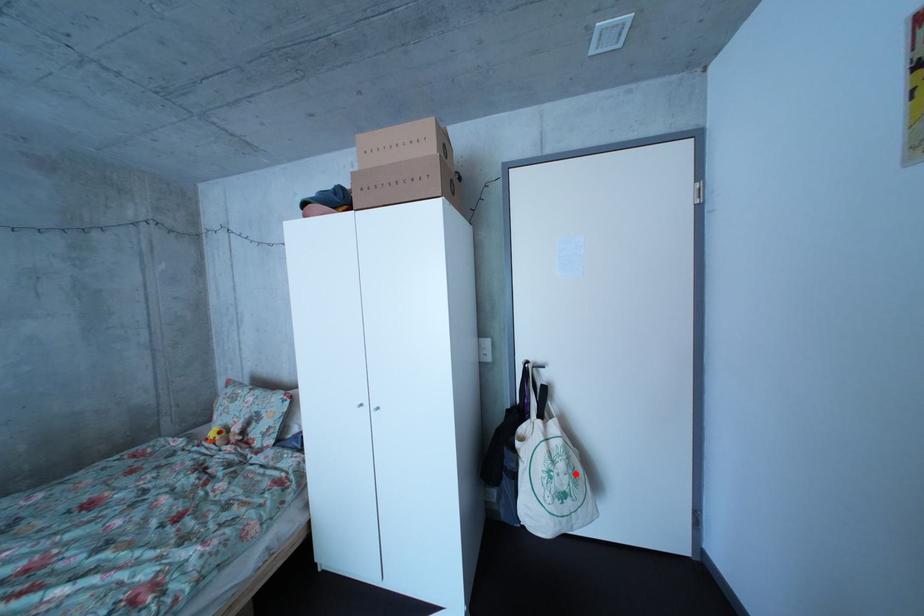
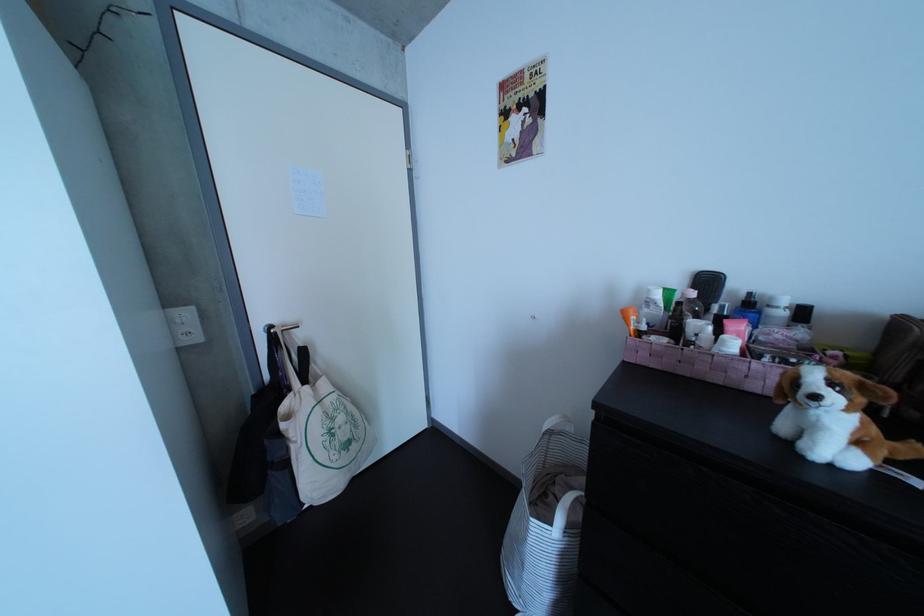
Where in the second image is the point corresponding to the highlighted location from the first image?

(355, 426)